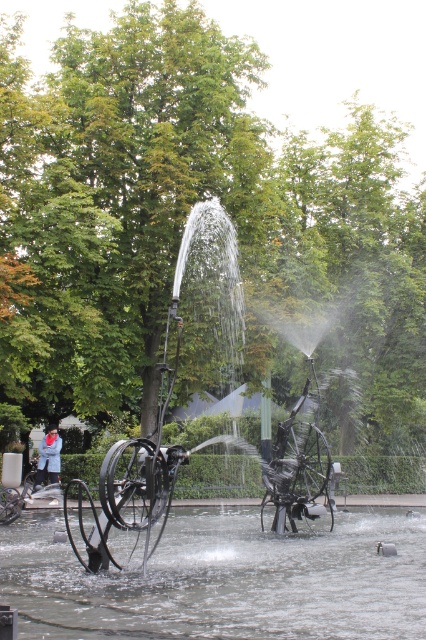
You are standing in front of the fountain and want to take a photo of the black metal sculpture at center. If your camera has a maximum focus range of 18 feet, will it be able to capture the sculpture clearly?

The black metal sculpture at center is 17.95 feet away from camera, so yes, the camera can focus on it since the distance is within the maximum focus range of 18 feet.